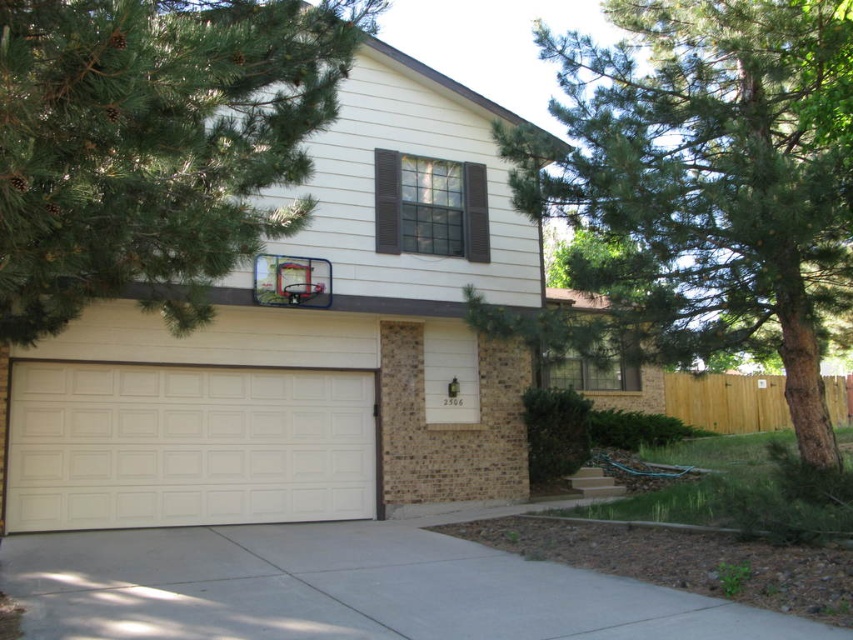
You are standing in the front yard of the house and want to enter the garage. Which object should you approach first, the white textured garage door at center or the gray concrete driveway at lower center?

You should approach the gray concrete driveway at lower center first because the white textured garage door at center is above it, meaning the driveway is closer to you.

From the picture: You are standing in front of the house and want to locate the point at coordinates (708, 180). Based on the scene description, where would you find this point?

The point at coordinates (708, 180) is located on the green leafy tree at upper right.

You are standing at the front yard of the house and want to walk to the point marked as point (x=422, y=429). However, there is an obstacle at point (x=801, y=628). Will you be able to reach your destination without going around the obstacle?

Since point (x=422, y=429) is behind point (x=801, y=628), you will have to go around the obstacle at point (x=801, y=628) to reach your destination.